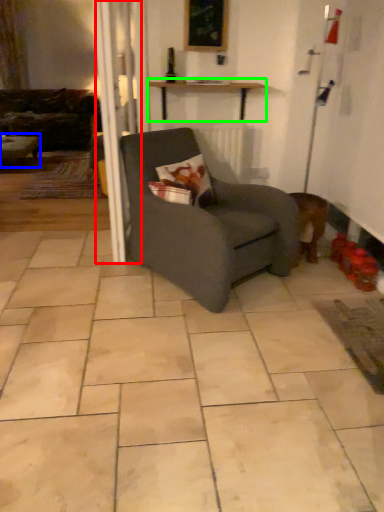
Question: Estimate the real-world distances between objects in this image. Which object is closer to screen door (highlighted by a red box), table (highlighted by a blue box) or table (highlighted by a green box)?

Choices:
 (A) table
 (B) table

Answer: (B)